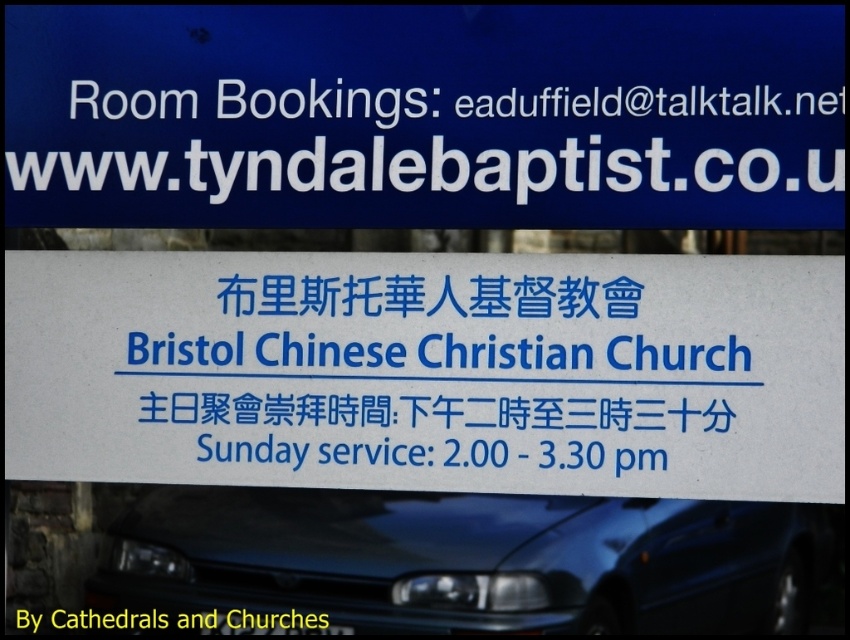
Measure the distance between point [632,64] and camera.

Point [632,64] and camera are 2.98 meters apart from each other.

What do you see at coordinates (425, 115) in the screenshot? Image resolution: width=850 pixels, height=640 pixels. I see `blue plastic sign at upper center` at bounding box center [425, 115].

The image size is (850, 640). I want to click on blue plastic sign at upper center, so click(425, 115).

Is white paper sign at center taller than glossy blue car at lower center?

Indeed, white paper sign at center has a greater height compared to glossy blue car at lower center.

Between white paper sign at center and glossy blue car at lower center, which one appears on the right side from the viewer's perspective?

glossy blue car at lower center is more to the right.

Is point (564, 260) farther from camera compared to point (497, 586)?

Yes, point (564, 260) is behind point (497, 586).

The height and width of the screenshot is (640, 850). Find the location of `white paper sign at center`. white paper sign at center is located at coordinates (431, 365).

Can you confirm if blue plastic sign at upper center is positioned below white paper sign at center?

Incorrect, blue plastic sign at upper center is not positioned below white paper sign at center.

Who is more forward, (218,8) or (163,378)?

Point (163,378) is in front.

Identify the location of blue plastic sign at upper center. Image resolution: width=850 pixels, height=640 pixels. (425, 115).